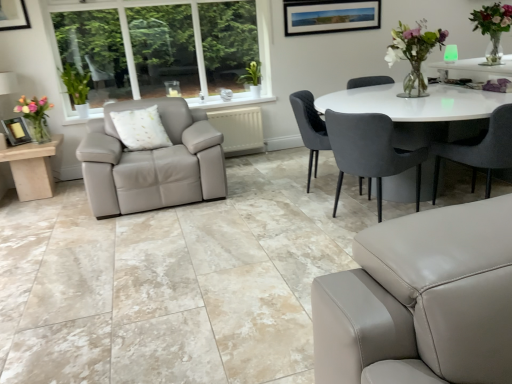
Question: Looking at their shapes, would you say translucent glass vase at left is wider or thinner than green leafy plant at left?

Choices:
 (A) wide
 (B) thin

Answer: (A)

Question: Visually, is translucent glass vase at left positioned to the left or to the right of green leafy plant at left?

Choices:
 (A) left
 (B) right

Answer: (A)

Question: Based on their relative distances, which object is nearer to the beige marble side table at left?

Choices:
 (A) velvet grey chair at center, arranged as the 3th chair when viewed from the right
 (B) green leafy plant at left
 (C) matte gray chair at right, the third chair positioned from the left
 (D) translucent glass vase at left
 (E) matte black picture frame at lower left

Answer: (E)

Question: Estimate the real-world distances between objects in this image. Which object is farther from the beige marble side table at left?

Choices:
 (A) translucent glass vase at left
 (B) velvet dark gray chair at center, which is the second chair from right to left
 (C) matte black picture frame at lower left
 (D) matte gray chair at right, the first chair viewed from the right
 (E) green leafy plant at left

Answer: (D)